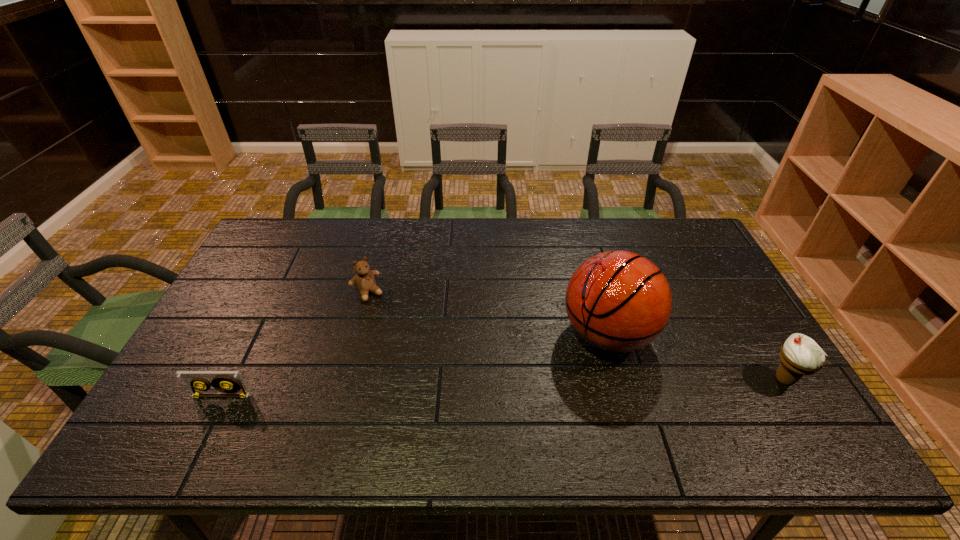
Identify the location of object that is at the near right corner. (800, 355).

In the image, there is a desktop. Where is `free space at the far edge`? free space at the far edge is located at coordinates click(x=592, y=241).

Identify the location of free space at the near edge of the desktop. The image size is (960, 540). (313, 412).

Identify the location of free region at the left edge of the desktop. The height and width of the screenshot is (540, 960). (200, 339).

What are the coordinates of `blank space at the right edge of the desktop` in the screenshot? It's located at [x=678, y=285].

The image size is (960, 540). Find the location of `vacant space at the far left corner of the desktop`. vacant space at the far left corner of the desktop is located at coordinates pos(289,232).

Image resolution: width=960 pixels, height=540 pixels. I want to click on free space at the near left corner of the desktop, so click(214, 400).

Locate an element on the screen. This screenshot has width=960, height=540. vacant space at the far right corner of the desktop is located at coordinates (695, 258).

The width and height of the screenshot is (960, 540). What are the coordinates of `vacant space at the near right corner of the desktop` in the screenshot? It's located at (732, 399).

Identify the location of empty location between the basketball and the teddy bear. Image resolution: width=960 pixels, height=540 pixels. (488, 314).